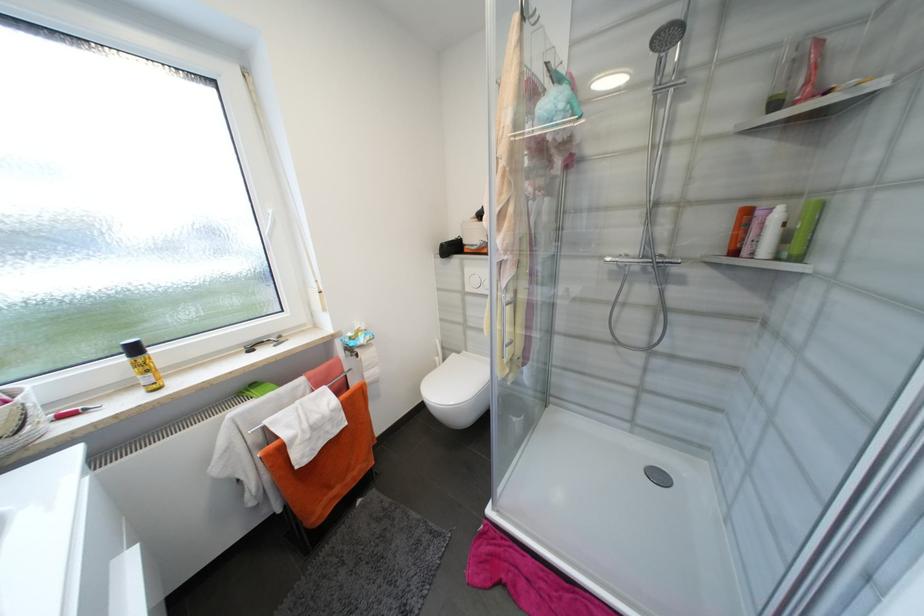
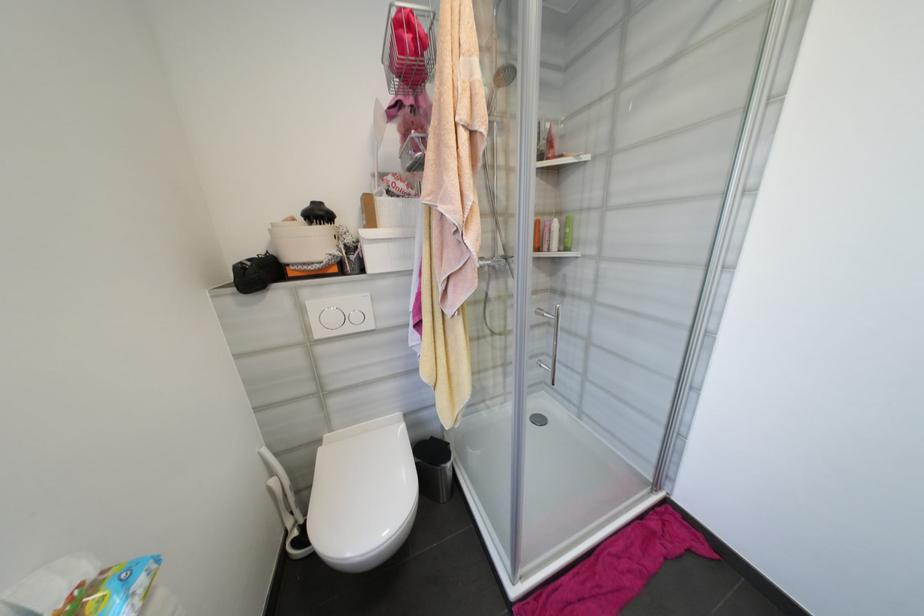
Question: The first image is from the beginning of the video and the second image is from the end. How did the camera likely rotate when shooting the video?

Choices:
 (A) Left
 (B) Right
 (C) Up
 (D) Down

Answer: (B)